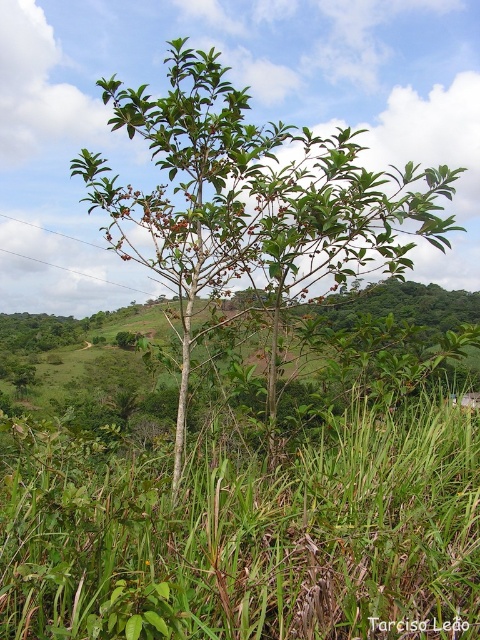
Between green grass at center and green leafy tree at center, which one has more height?

green leafy tree at center

Looking at this image, is green grass at center positioned before green leafy tree at center?

Yes, green grass at center is in front of green leafy tree at center.

Between point (397, 620) and point (144, 260), which one is positioned in front?

Point (397, 620) is more forward.

Locate an element on the screen. The height and width of the screenshot is (640, 480). green grass at center is located at coordinates (248, 536).